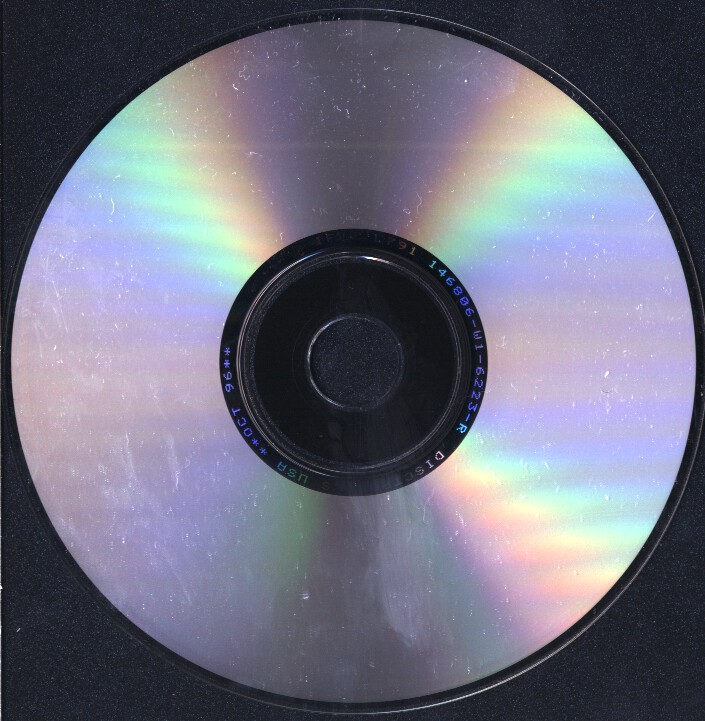
Find the location of `foam cloth`. foam cloth is located at coordinates (373, 363).